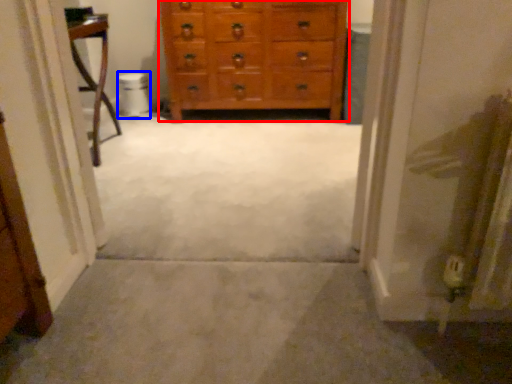
Question: Which object appears closest to the camera in this image, chest of drawers (highlighted by a red box) or toilet bowl (highlighted by a blue box)?

Choices:
 (A) chest of drawers
 (B) toilet bowl

Answer: (A)